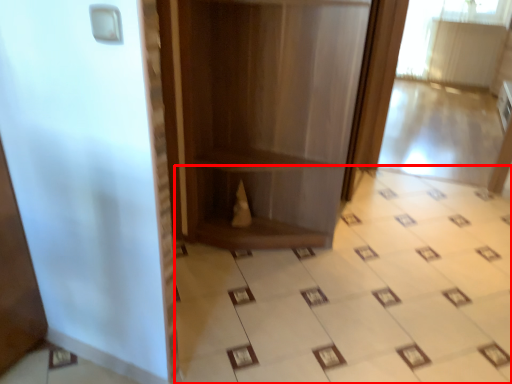
Question: From the image, what is the correct spatial relationship of ceramic tile (annotated by the red box) in relation to bookshelf?

Choices:
 (A) left
 (B) right

Answer: (B)